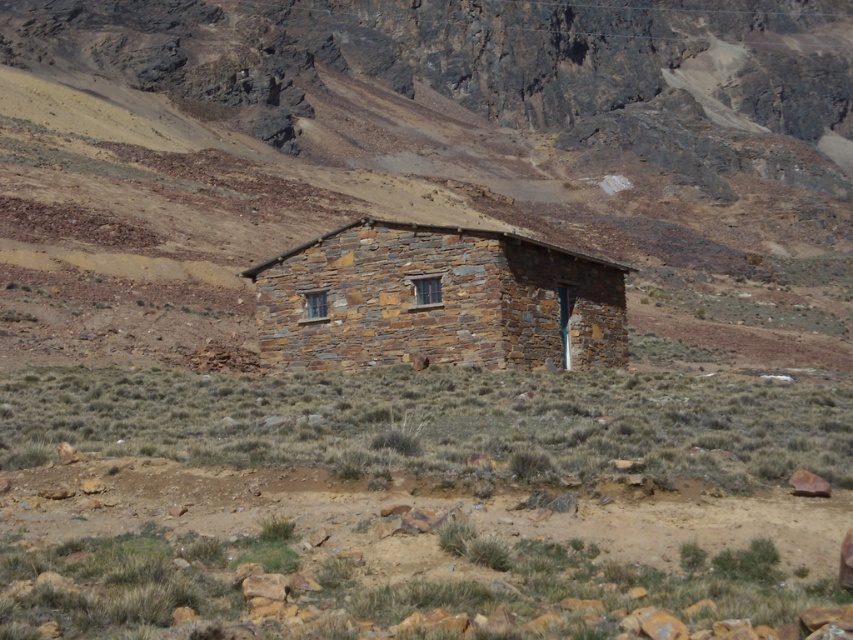
Is brown rocky terrain at center smaller than rustic stone hut at center?

No.

Can you confirm if brown rocky terrain at center is positioned below rustic stone hut at center?

Correct, brown rocky terrain at center is located below rustic stone hut at center.

In order to click on brown rocky terrain at center in this screenshot , I will do `click(415, 500)`.

The width and height of the screenshot is (853, 640). Find the location of `brown rocky terrain at center`. brown rocky terrain at center is located at coordinates (415, 500).